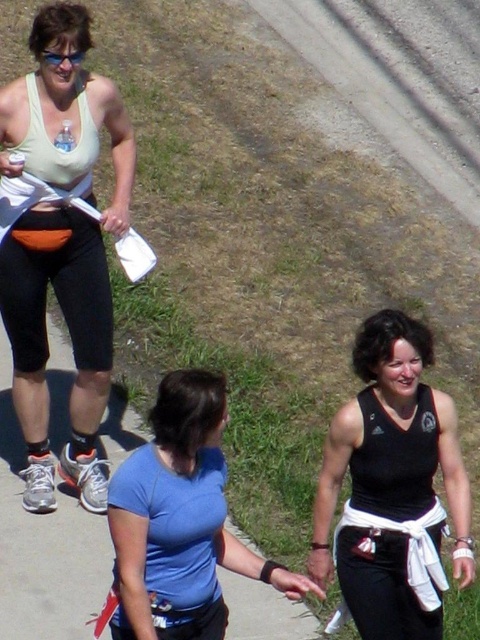
You are a photographer standing at the edge of the path. You want to take a photo that includes both the blue fabric shirt at center and the clear plastic goggles at upper left. Based on their sizes in the image, which object should you focus on first to ensure both are in frame?

The blue fabric shirt at center has a greater height compared to the clear plastic goggles at upper left. To ensure both are in frame, focus on the larger blue fabric shirt at center first, then adjust to include the smaller goggles.

You are standing on the paved path and want to move from the point closer to you to the point further away. Which path should you take between the two points, point (357, 410) and point (168, 573)?

To move from the closer point to the further one, you should go from point (168, 573) to point (357, 410) since point (357, 410) is further away from you.

You are a photographer standing at the edge of the path. You want to take a photo that includes both the blue fabric shirt at center and the clear plastic goggles at upper left. Which object should you adjust your camera focus to first to ensure both are in frame?

The blue fabric shirt at center is larger in size compared to the clear plastic goggles at upper left, so you should focus on the blue fabric shirt at center first to ensure it fits within the frame before adjusting for the smaller goggles.